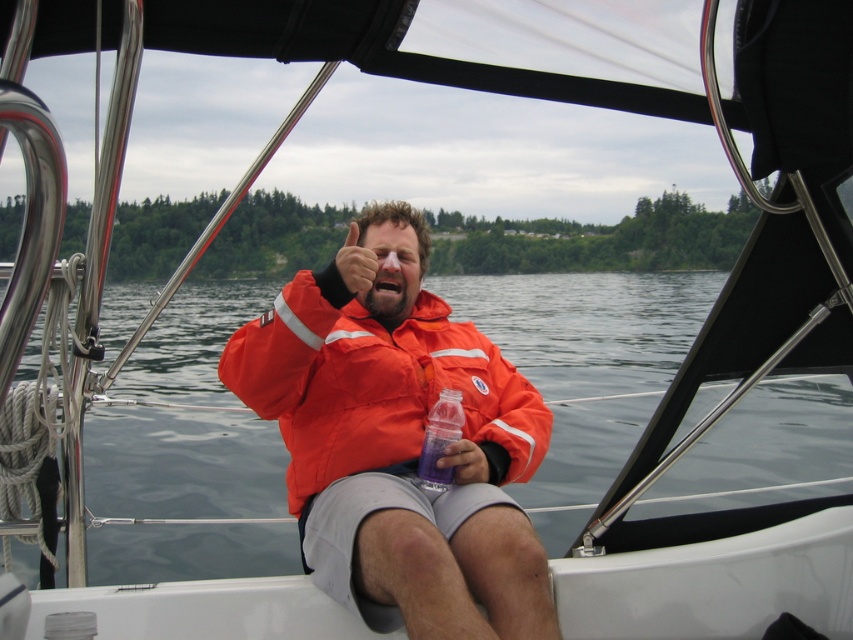
Looking at this image, you are on a boat and need to reach for the translucent purple bottle at center. Which direction should you move relative to the orange fabric jacket at center?

To reach the translucent purple bottle at center, you should move to the right of the orange fabric jacket at center since the orange fabric jacket at center is to the left of the translucent purple bottle at center.

You are a photographer on the boat and want to capture both the orange fabric jacket at center and the translucent purple bottle at center in a single shot. Which object should you focus on first to ensure both are in frame?

You should focus on the orange fabric jacket at center first since it is taller than the translucent purple bottle at center, ensuring both will fit within the frame.